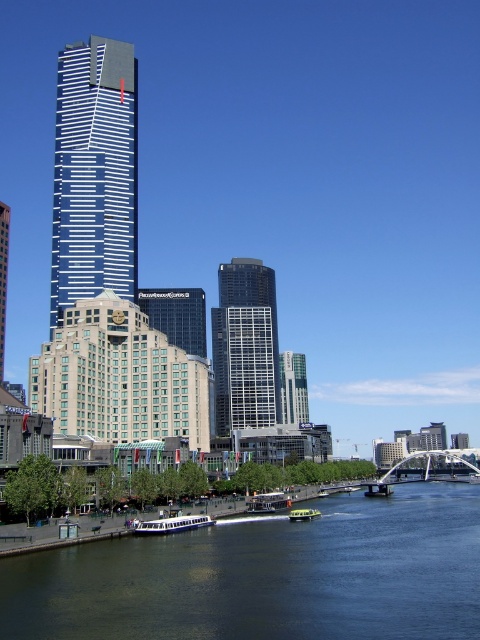
You are a tour guide on the river and need to ensure safety between the two boats. Given that the minimum safe distance between boats on this river is 5 meters, can both the white plastic boat at center and the green matte boat at center maintain safe distance?

The white plastic boat at center and the green matte boat at center are 4.34 meters apart from each other, which is less than the required 5 meters for safe distance. Therefore, they are too close and need to adjust their positions to maintain safety.

You are an architect analyzing the urban riverside scene. You observe the dark glass skyscraper at center and the glassy reflective skyscraper at center. Which one is positioned higher in the image?

The dark glass skyscraper at center is positioned higher than the glassy reflective skyscraper at center in the image.